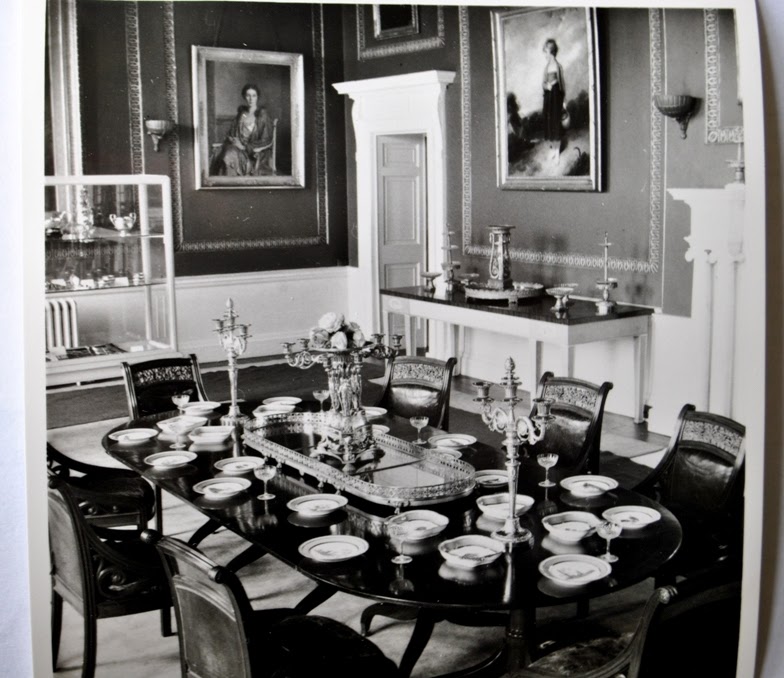
Where is `chair tops`? chair tops is located at coordinates click(x=56, y=483), click(x=171, y=352), click(x=412, y=348), click(x=576, y=382), click(x=713, y=411), click(x=702, y=596), click(x=223, y=576).